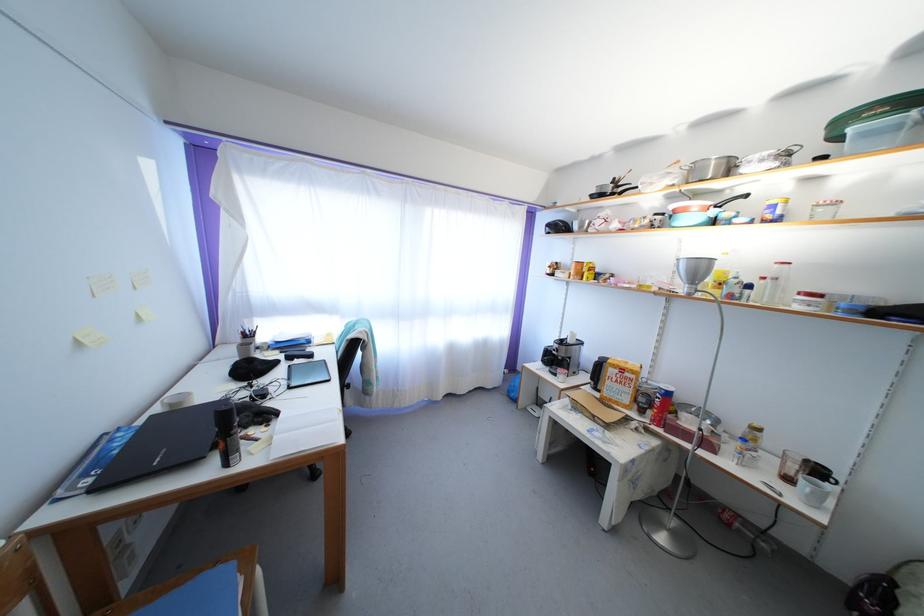
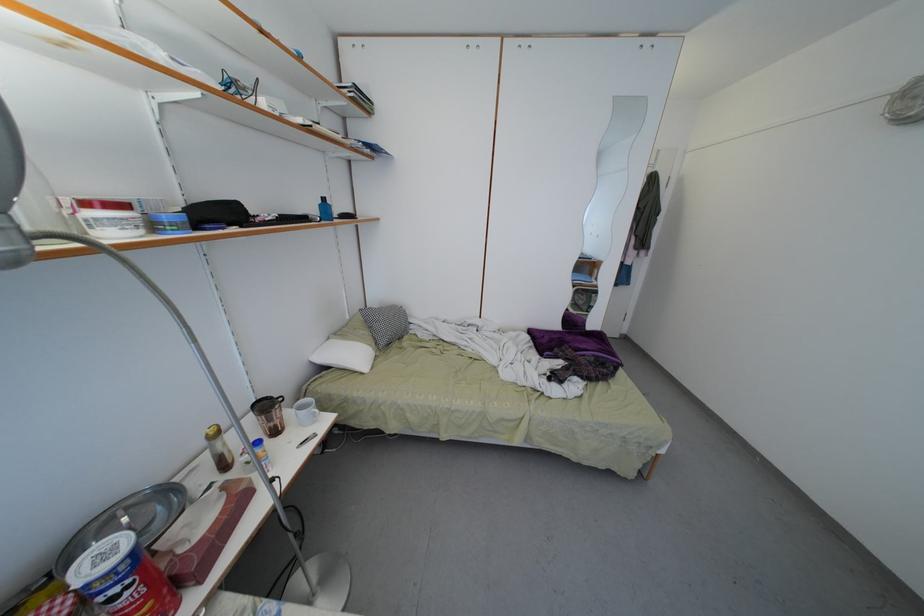
In the second image, find the point that corresponds to pixel 806 300 in the first image.

(91, 209)